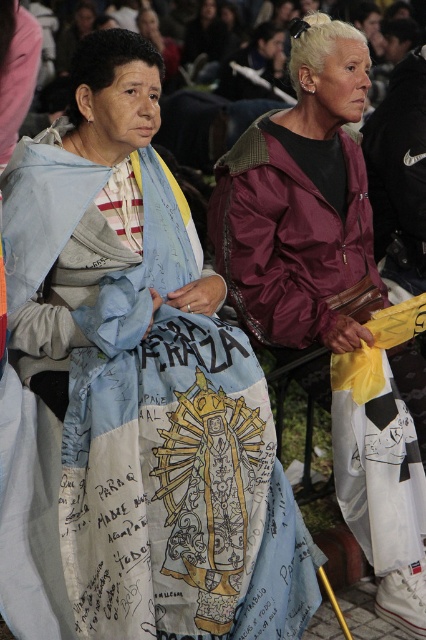
Is point (100, 396) less distant than point (411, 566)?

Yes.

Who is lower down, blue fabric shawl at left or maroon nylon jacket at center?

blue fabric shawl at left is lower down.

The image size is (426, 640). I want to click on blue fabric shawl at left, so click(x=140, y=392).